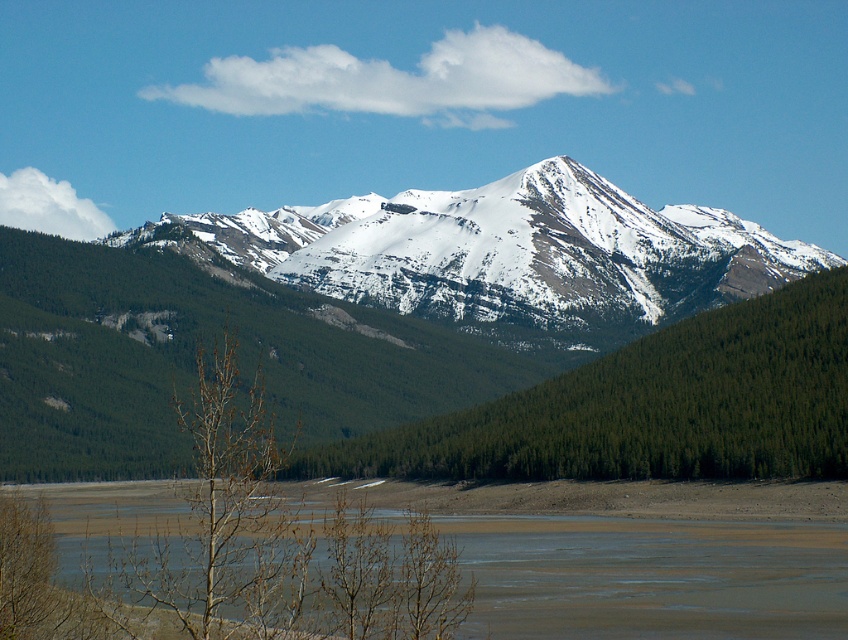
Between green matte tree at center and brown sandy river at lower center, which one is positioned lower?

brown sandy river at lower center is lower down.

Is green matte tree at center positioned at the back of brown sandy river at lower center?

Yes, it is.

Which is behind, point (699, 321) or point (657, 632)?

Point (699, 321)

Where is `green matte tree at center`? green matte tree at center is located at coordinates (650, 406).

Measure the distance between snowy rocky mountain at center and brown sandy river at lower center.

A distance of 99.89 meters exists between snowy rocky mountain at center and brown sandy river at lower center.

Consider the image. Is snowy rocky mountain at center to the right of brown sandy river at lower center from the viewer's perspective?

Correct, you'll find snowy rocky mountain at center to the right of brown sandy river at lower center.

This screenshot has width=848, height=640. Describe the element at coordinates (505, 253) in the screenshot. I see `snowy rocky mountain at center` at that location.

At what (x,y) coordinates should I click in order to perform the action: click on snowy rocky mountain at center. Please return your answer as a coordinate pair (x, y). Looking at the image, I should click on (505, 253).

Find the location of a particular element. The height and width of the screenshot is (640, 848). snowy rocky mountain at center is located at coordinates (505, 253).

Is snowy rocky mountain at center bigger than green matte tree at center?

Indeed, snowy rocky mountain at center has a larger size compared to green matte tree at center.

Is point (285, 225) farther from camera compared to point (696, 342)?

Yes.

This screenshot has height=640, width=848. In order to click on snowy rocky mountain at center in this screenshot , I will do `click(505, 253)`.